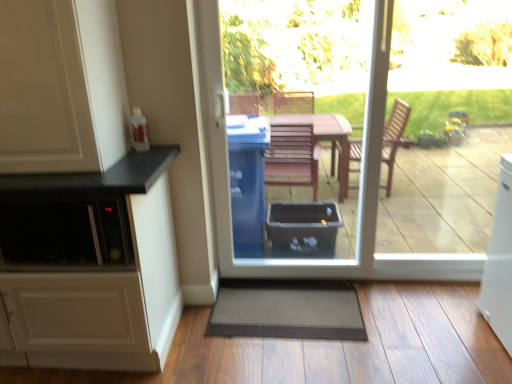
Question: Can gray textured mat at lower center be found inside white matte cabinet at left, which appears as the 2th cabinetry when viewed from the top?

Choices:
 (A) yes
 (B) no

Answer: (B)

Question: Is white matte cabinet at left, which appears as the 2th cabinetry when viewed from the top, completely or partially outside of gray textured mat at lower center?

Choices:
 (A) no
 (B) yes

Answer: (B)

Question: Is white matte cabinet at left, marked as the 1th cabinetry in a bottom-to-top arrangement, at the right side of gray textured mat at lower center?

Choices:
 (A) yes
 (B) no

Answer: (B)

Question: From the image's perspective, is white matte cabinet at left, which appears as the 2th cabinetry when viewed from the top, below gray textured mat at lower center?

Choices:
 (A) yes
 (B) no

Answer: (B)

Question: From a real-world perspective, does white matte cabinet at left, which appears as the 2th cabinetry when viewed from the top, sit lower than gray textured mat at lower center?

Choices:
 (A) yes
 (B) no

Answer: (B)

Question: From the image's perspective, is white matte cabinet at left, marked as the second cabinetry in a bottom-to-top arrangement, above or below transparent plastic bin at center?

Choices:
 (A) above
 (B) below

Answer: (A)

Question: Considering the positions of point (14, 6) and point (470, 276), is point (14, 6) closer or farther from the camera than point (470, 276)?

Choices:
 (A) farther
 (B) closer

Answer: (B)

Question: In the image, is white matte cabinet at left, marked as the second cabinetry in a bottom-to-top arrangement, positioned in front of or behind transparent plastic bin at center?

Choices:
 (A) front
 (B) behind

Answer: (A)

Question: Looking at the image, does white matte cabinet at left, marked as the second cabinetry in a bottom-to-top arrangement, seem bigger or smaller compared to transparent plastic bin at center?

Choices:
 (A) big
 (B) small

Answer: (B)

Question: From a real-world perspective, is transparent plastic bin at center positioned above or below white matte cabinet at left, which appears as the 2th cabinetry when viewed from the top?

Choices:
 (A) below
 (B) above

Answer: (B)

Question: Looking at their shapes, would you say transparent plastic bin at center is wider or thinner than white matte cabinet at left, marked as the 1th cabinetry in a bottom-to-top arrangement?

Choices:
 (A) thin
 (B) wide

Answer: (A)

Question: Relative to white matte cabinet at left, marked as the 1th cabinetry in a bottom-to-top arrangement, is transparent plastic bin at center in front or behind?

Choices:
 (A) front
 (B) behind

Answer: (B)

Question: Considering the relative positions of transparent plastic bin at center and white matte cabinet at left, marked as the 1th cabinetry in a bottom-to-top arrangement, in the image provided, is transparent plastic bin at center to the left or to the right of white matte cabinet at left, marked as the 1th cabinetry in a bottom-to-top arrangement,?

Choices:
 (A) right
 (B) left

Answer: (A)

Question: From a real-world perspective, is transparent plastic bin at center physically located above or below white matte cabinet at left, marked as the second cabinetry in a bottom-to-top arrangement?

Choices:
 (A) above
 (B) below

Answer: (B)

Question: In terms of size, does transparent plastic bin at center appear bigger or smaller than white matte cabinet at left, the 1th cabinetry positioned from the top?

Choices:
 (A) small
 (B) big

Answer: (B)